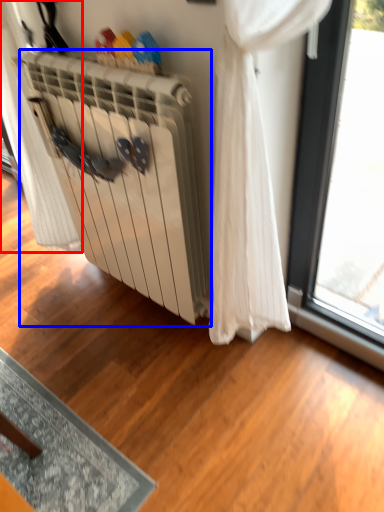
Question: Which object appears closest to the camera in this image, curtain (highlighted by a red box) or radiator (highlighted by a blue box)?

Choices:
 (A) curtain
 (B) radiator

Answer: (B)